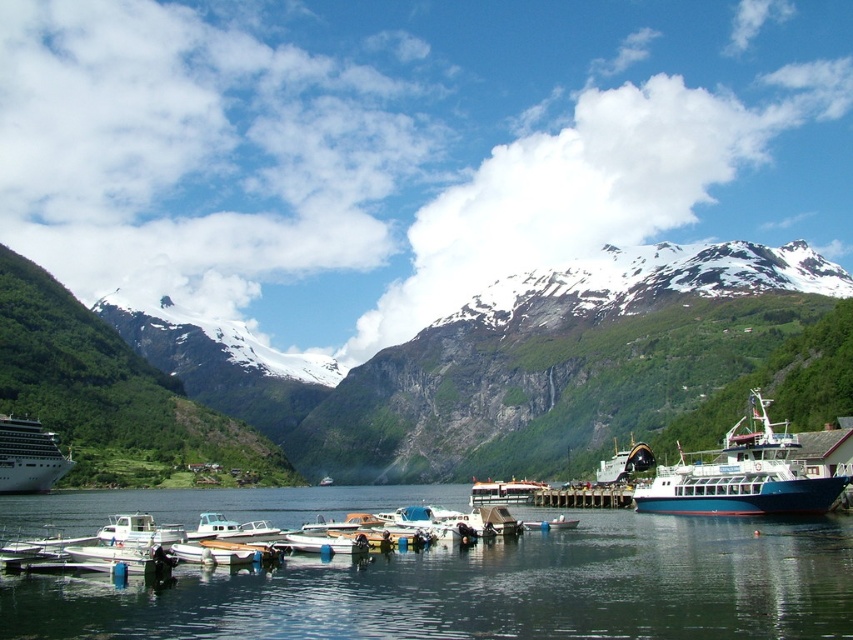
Can you confirm if green rocky mountain at center is smaller than wooden dock at center?

Actually, green rocky mountain at center might be larger than wooden dock at center.

Is green rocky mountain at center above wooden dock at center?

Yes.

Where is `green rocky mountain at center`? This screenshot has width=853, height=640. green rocky mountain at center is located at coordinates (415, 371).

Identify the location of green rocky mountain at center. (415, 371).

Based on the photo, can you confirm if transparent water at center is positioned below metallic blue ferry at center?

Incorrect, transparent water at center is not positioned below metallic blue ferry at center.

Does point (254, 573) come behind point (604, 477)?

No, (254, 573) is closer to viewer.

Is point (9, 636) positioned behind point (635, 461)?

No.

Locate an element on the screen. This screenshot has height=640, width=853. transparent water at center is located at coordinates (496, 588).

Who is positioned more to the left, green rocky mountain at center or metallic blue ferry at center?

Positioned to the left is green rocky mountain at center.

Is green rocky mountain at center to the right of metallic blue ferry at center from the viewer's perspective?

No, green rocky mountain at center is not to the right of metallic blue ferry at center.

Where is `green rocky mountain at center`? This screenshot has width=853, height=640. green rocky mountain at center is located at coordinates (415, 371).